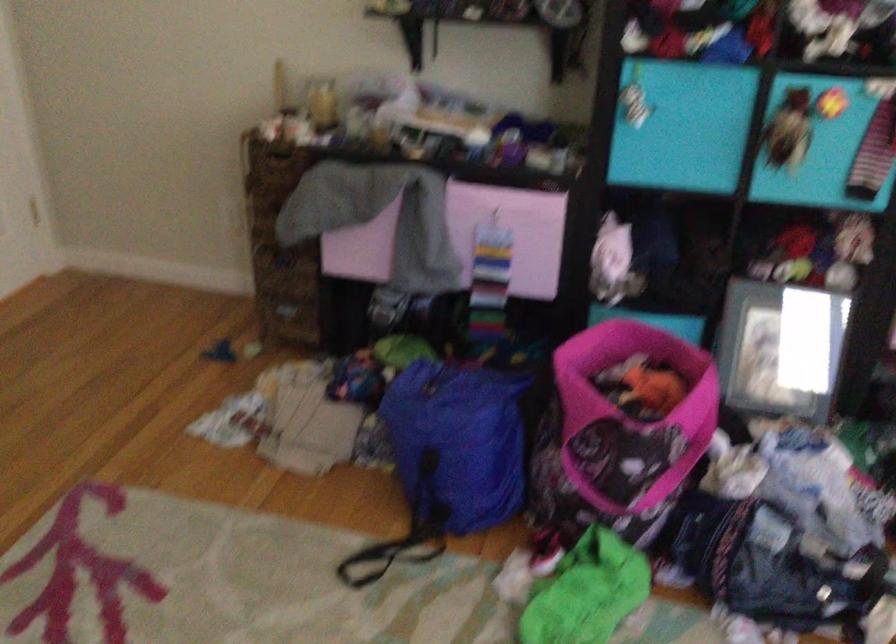
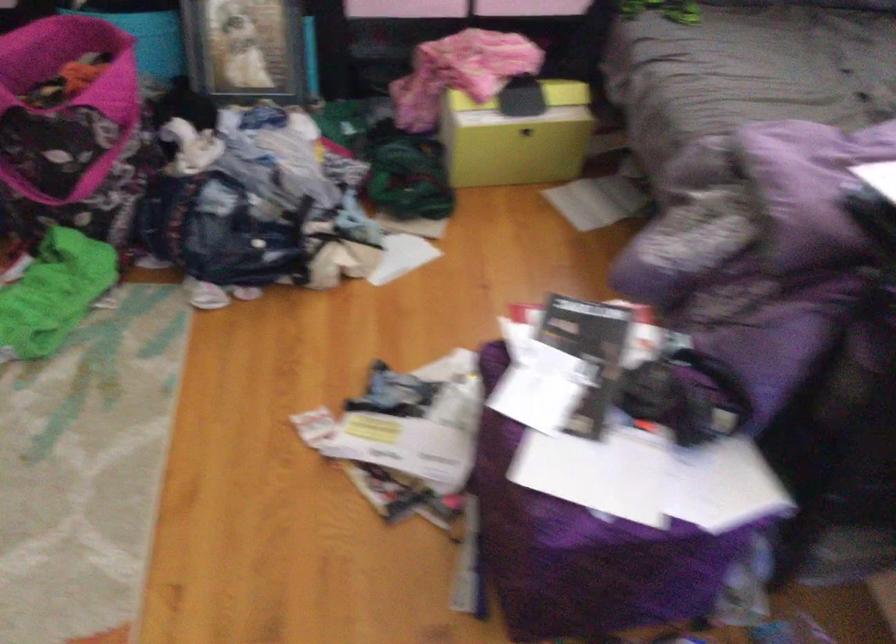
The images are taken continuously from a first-person perspective. In which direction is your viewpoint rotating?

The camera rotated toward right-down.